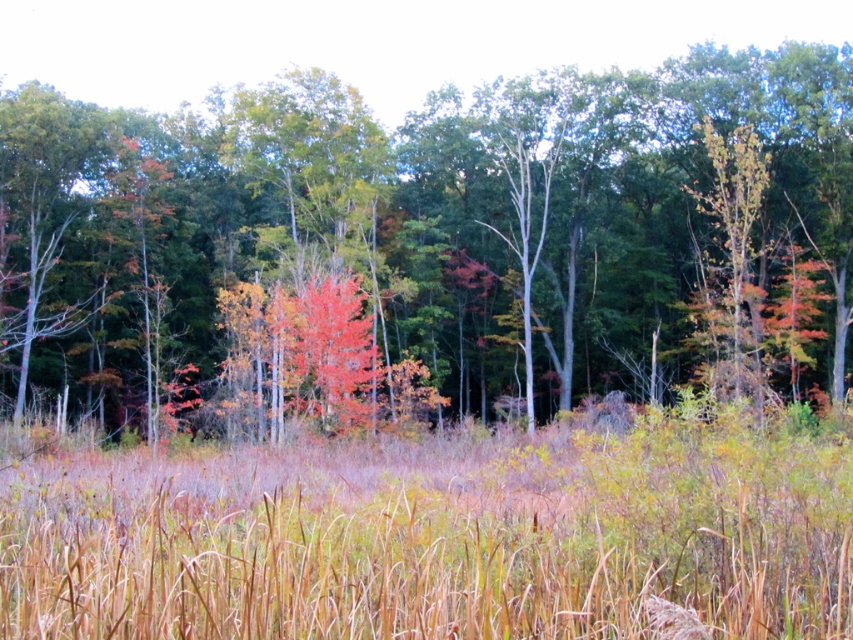
Question: Does brown dry grass at center have a smaller size compared to green matte tree at center?

Choices:
 (A) no
 (B) yes

Answer: (B)

Question: Does smooth red tree at center have a greater width compared to green matte tree at center?

Choices:
 (A) no
 (B) yes

Answer: (B)

Question: Can you confirm if smooth red tree at center is positioned above green matte tree at center?

Choices:
 (A) yes
 (B) no

Answer: (A)

Question: Which object is the closest to the brown dry grass at center?

Choices:
 (A) green matte tree at center
 (B) smooth red tree at center

Answer: (A)

Question: Which is farther from the smooth red tree at center?

Choices:
 (A) green matte tree at center
 (B) brown dry grass at center

Answer: (B)

Question: Which point is closer to the camera taking this photo?

Choices:
 (A) (729, 376)
 (B) (610, 131)

Answer: (A)